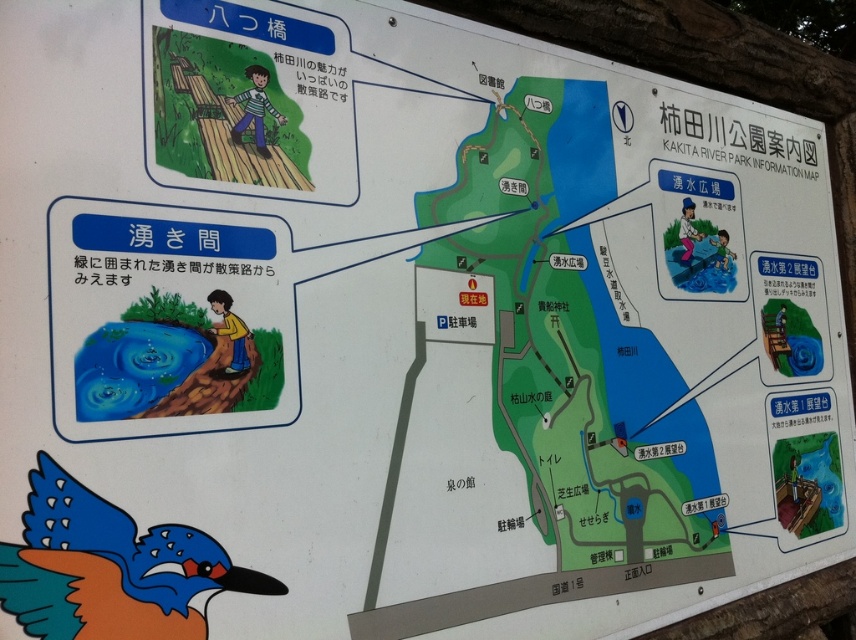
You are standing at the entrance of Kakita River Park and see a blue glossy kingfisher marked at point (x=110, y=568) on the map. If you walk straight from the entrance, will you reach the blue glossy kingfisher before reaching the central river?

The blue glossy kingfisher at point (x=110, y=568) is located at the lower left of the map. Since the central river runs through the park, walking straight from the entrance might first encounter the central river before reaching the kingfisher. However, without specific path details, it is uncertain. Please check the map for the exact route.

You are planning to take a photo of the wooden bridge at upper left from the blue glossy water at lower left. Considering their heights, will the water area be higher or lower than the bridge when framing the shot?

The blue glossy water at lower left has a greater height compared to the wooden bridge at upper left, so when taking the photo from the water area, the bridge will appear lower in the frame.

You are standing at the camera position in the Kakita River Park map. There is a blue glossy water at lower left. Can you walk directly to it without crossing any pathways or landmarks?

The blue glossy water at lower left is 1.09 meters away from the camera position, so yes, you can walk directly to it without crossing any pathways or landmarks.